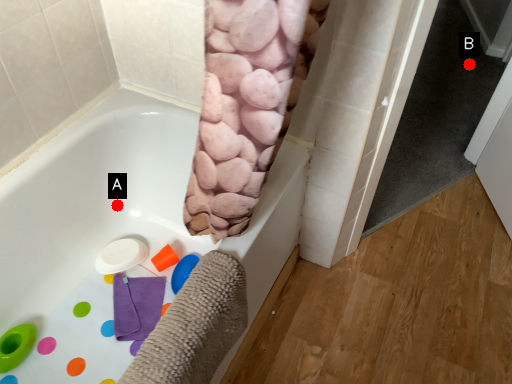
Question: Two points are circled on the image, labeled by A and B beside each circle. Which point appears farthest from the camera in this image?

Choices:
 (A) A is further
 (B) B is further

Answer: (B)